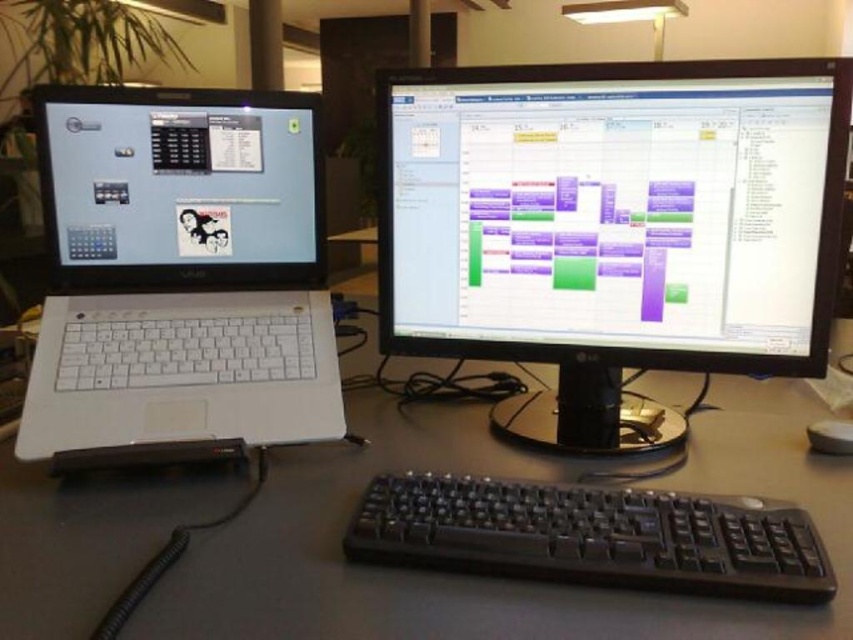
Question: Where is matte black monitor at center located in relation to black plastic keyboard at center in the image?

Choices:
 (A) right
 (B) left

Answer: (A)

Question: Which point is closer to the camera?

Choices:
 (A) pyautogui.click(x=294, y=97)
 (B) pyautogui.click(x=376, y=412)
 (C) pyautogui.click(x=769, y=310)
 (D) pyautogui.click(x=608, y=580)

Answer: (D)

Question: Among these points, which one is nearest to the camera?

Choices:
 (A) (570, 493)
 (B) (0, 524)
 (C) (822, 109)

Answer: (B)

Question: Which point is farther to the camera?

Choices:
 (A) black plastic mouse at lower right
 (B) white plastic laptop at left

Answer: (A)

Question: Is white plastic laptop at left closer to the viewer compared to black plastic keyboard at center?

Choices:
 (A) no
 (B) yes

Answer: (A)

Question: In this image, where is white plastic laptop at left located relative to black plastic mouse at lower right?

Choices:
 (A) left
 (B) right

Answer: (A)